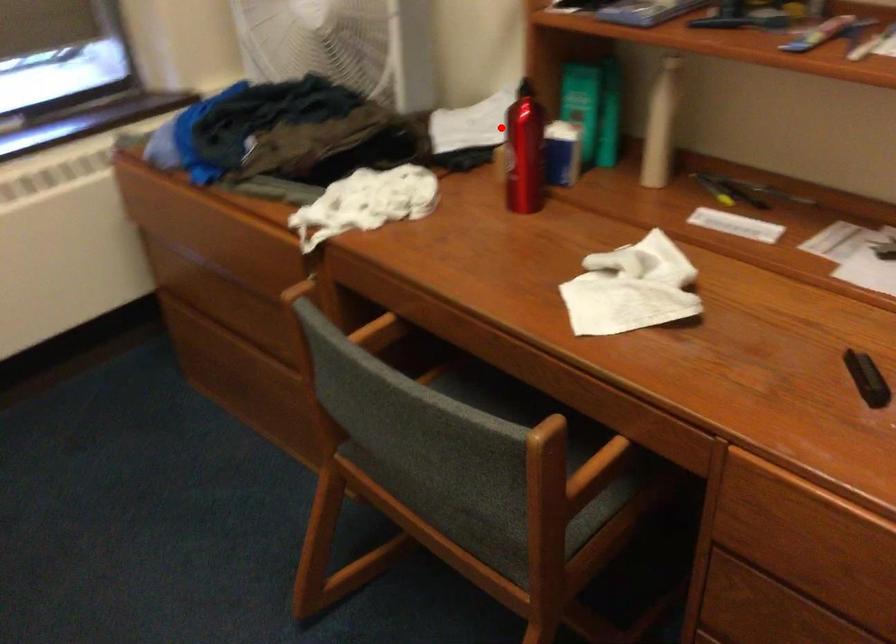
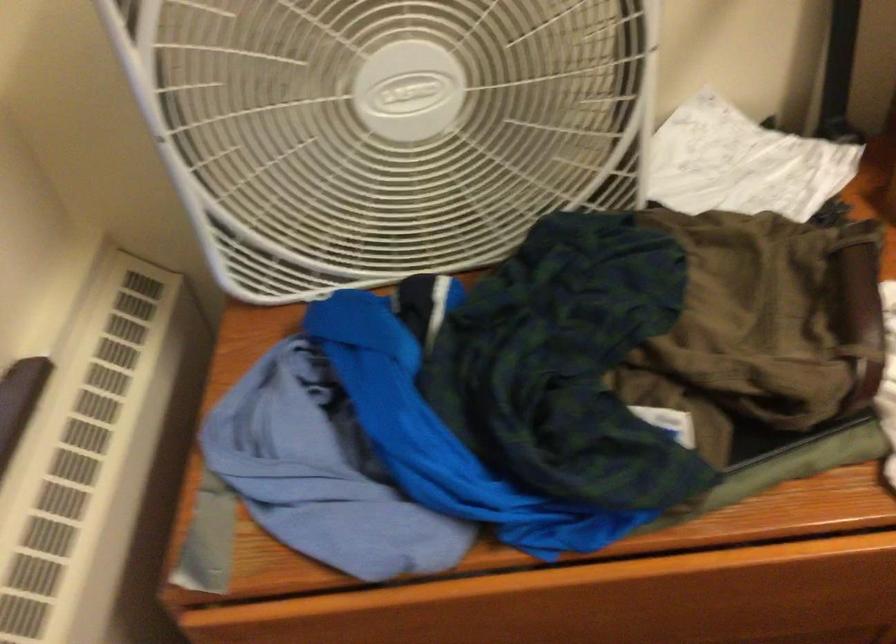
The point at the highlighted location is marked in the first image. Where is the corresponding point in the second image?

(742, 164)